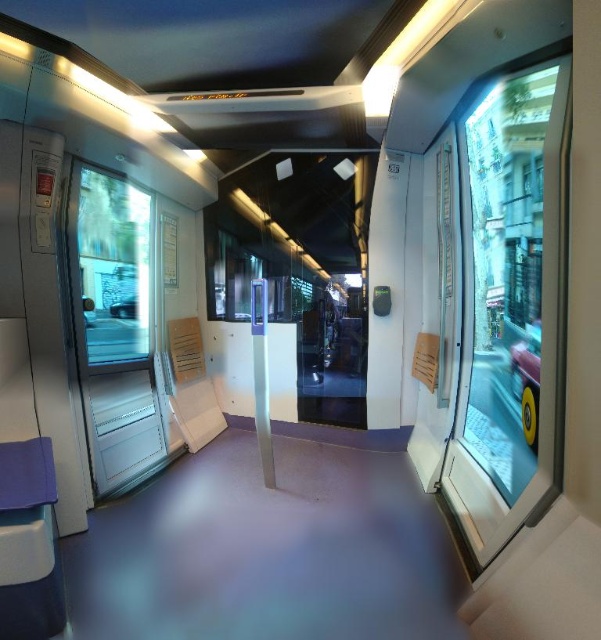
You are standing in the modern train carriage and want to look outside through the nearest window. Which window should you approach, the transparent glass window at right or the transparent glass window at left?

The transparent glass window at right is in front of the transparent glass window at left, so the nearest window would be the transparent glass window at right. Approach that one to look outside.

You are a passenger standing in the middle of the train carriage. You want to look outside through the transparent glass window at right and the transparent glass window at left. Which window is closer to the floor?

The transparent glass window at right is located below the transparent glass window at left, so the transparent glass window at right is closer to the floor.

You are standing in the train carriage and want to reach the two points marked in the scene. Which point, point (510, 326) or point (114, 214), is closer to you?

Point (510, 326) is closer to the viewer than point (114, 214).